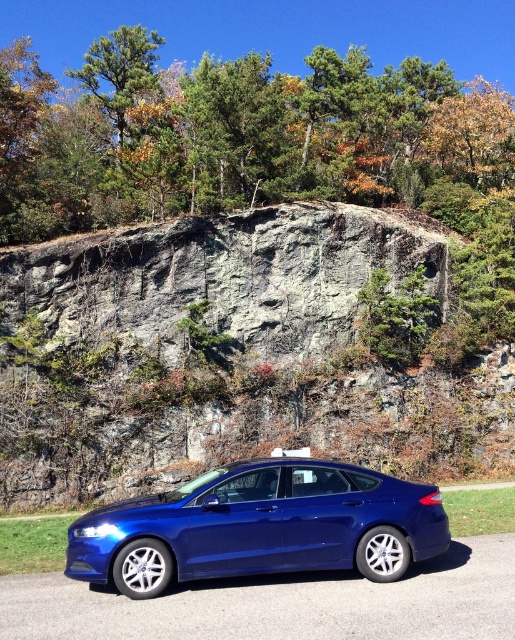
You are standing on the road next to the metallic blue car at center and want to take a photo of the green leafy tree at upper center. In which direction should you point your camera relative to the car?

The green leafy tree at upper center is to the left of the metallic blue car at center, so you should point your camera to the left relative to the car to capture the tree.

You are standing in front of the car and looking at the two points marked on the image. Which point, point (138, 102) or point (70, 580), is closer to you?

Point (138, 102) is closer to you because it is further to the viewer than point (70, 580).